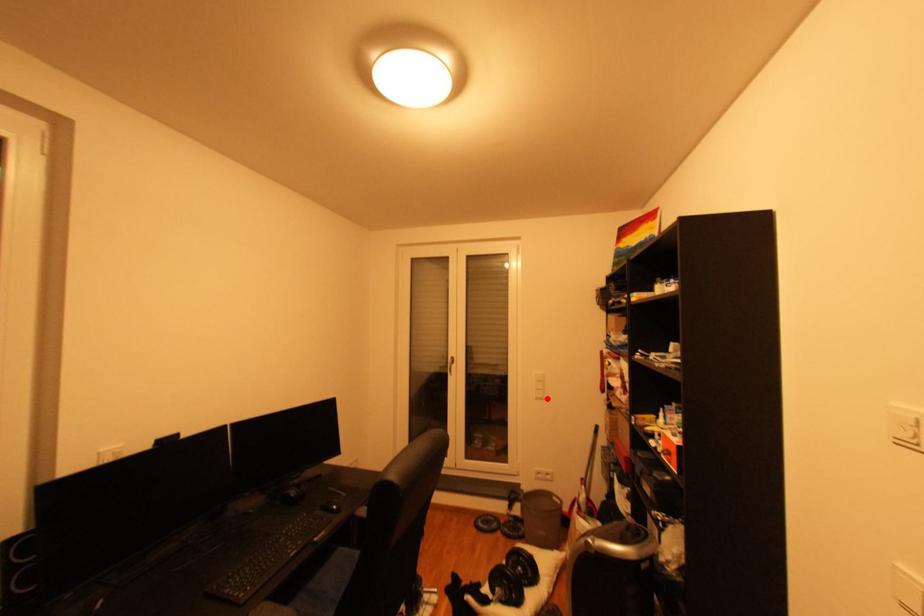
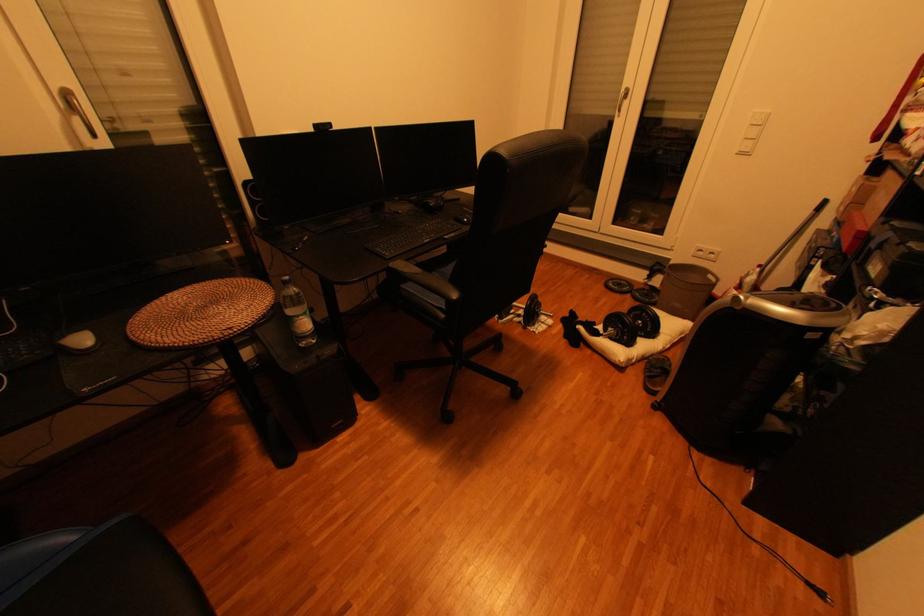
In the second image, find the point that corresponds to the highlighted location in the first image.

(749, 155)